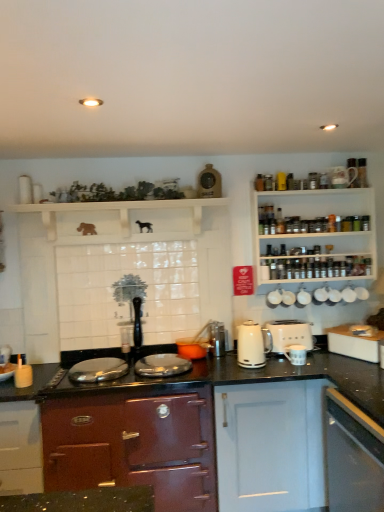
I want to click on vacant area that lies in front of white glossy electric kettle at center, so click(x=265, y=373).